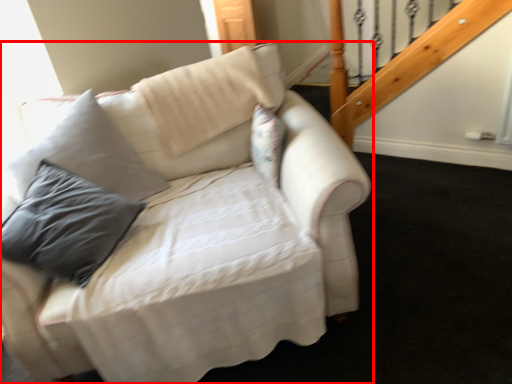
Question: In this image, where is studio couch (annotated by the red box) located relative to pillow?

Choices:
 (A) right
 (B) left

Answer: (B)